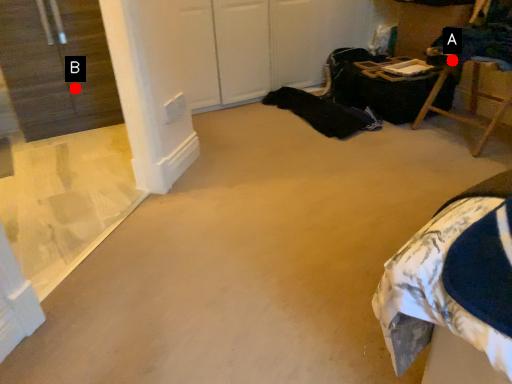
Question: Two points are circled on the image, labeled by A and B beside each circle. Which point is closer to the camera?

Choices:
 (A) A is closer
 (B) B is closer

Answer: (A)